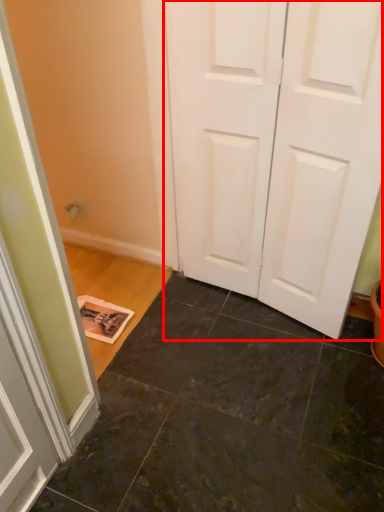
Question: From the image, what is the correct spatial relationship of door (annotated by the red box) in relation to tile?

Choices:
 (A) right
 (B) left

Answer: (A)